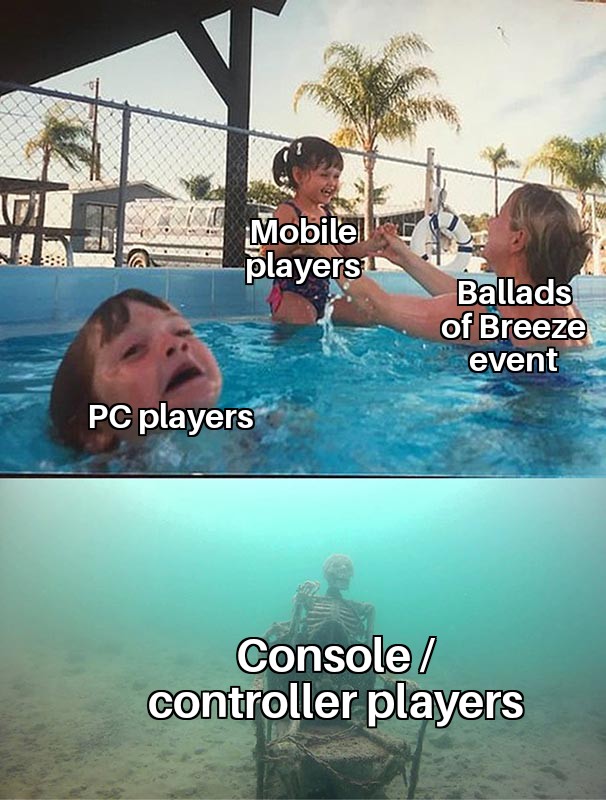
Locate an element on the screen. This screenshot has width=606, height=800. chair is located at coordinates (350, 750).